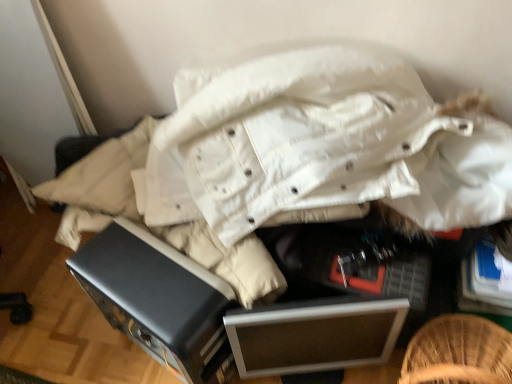
What is the approximate width of silver metallic file cabinet at center?

The width of silver metallic file cabinet at center is 14.58 centimeters.

This screenshot has width=512, height=384. In order to click on silver metallic file cabinet at center in this screenshot , I will do `click(314, 332)`.

What do you see at coordinates (314, 332) in the screenshot?
I see `silver metallic file cabinet at center` at bounding box center [314, 332].

In order to face silver metallic file cabinet at center, should I rotate leftwards or rightwards?

Turn right approximately 7.683 degrees to face it.

Image resolution: width=512 pixels, height=384 pixels. What are the coordinates of `black plastic drawer at center` in the screenshot? It's located at (224, 315).

Image resolution: width=512 pixels, height=384 pixels. What do you see at coordinates (224, 315) in the screenshot?
I see `black plastic drawer at center` at bounding box center [224, 315].

Measure the distance between black plastic drawer at center and camera.

The depth of black plastic drawer at center is 86.04 centimeters.

At what (x,y) coordinates should I click in order to perform the action: click on silver metallic file cabinet at center. Please return your answer as a coordinate pair (x, y). This screenshot has height=384, width=512. Looking at the image, I should click on (314, 332).

Consider the image. Considering the relative positions of silver metallic file cabinet at center and black plastic drawer at center in the image provided, is silver metallic file cabinet at center to the left or to the right of black plastic drawer at center?

Clearly, silver metallic file cabinet at center is on the right of black plastic drawer at center in the image.

Is silver metallic file cabinet at center closer to camera compared to black plastic drawer at center?

No, it is not.

Which is in front, point (239, 335) or point (182, 331)?

Point (182, 331)

From the image's perspective, is silver metallic file cabinet at center under black plastic drawer at center?

Indeed, from the image's perspective, silver metallic file cabinet at center is shown beneath black plastic drawer at center.

From a real-world perspective, which is physically above, silver metallic file cabinet at center or black plastic drawer at center?

black plastic drawer at center is physically above.

In the scene shown: Considering the sizes of objects silver metallic file cabinet at center and black plastic drawer at center in the image provided, who is thinner, silver metallic file cabinet at center or black plastic drawer at center?

silver metallic file cabinet at center is thinner.

Does silver metallic file cabinet at center have a lesser height compared to black plastic drawer at center?

Correct, silver metallic file cabinet at center is not as tall as black plastic drawer at center.

Which of these two, silver metallic file cabinet at center or black plastic drawer at center, is smaller?

Smaller between the two is silver metallic file cabinet at center.

Is silver metallic file cabinet at center completely or partially outside of black plastic drawer at center?

silver metallic file cabinet at center is positioned outside black plastic drawer at center.

Would you consider silver metallic file cabinet at center to be distant from black plastic drawer at center?

silver metallic file cabinet at center is near black plastic drawer at center, not far away.

Does silver metallic file cabinet at center turn towards black plastic drawer at center?

No, silver metallic file cabinet at center does not turn towards black plastic drawer at center.

What's the angular difference between silver metallic file cabinet at center and black plastic drawer at center's facing directions?

They differ by 47.5 degrees in their facing directions.

Find the location of `furniture located on the left of silver metallic file cabinet at center`. furniture located on the left of silver metallic file cabinet at center is located at coordinates (224, 315).

Can you confirm if black plastic drawer at center is positioned to the right of silver metallic file cabinet at center?

No.

Which is in front, black plastic drawer at center or silver metallic file cabinet at center?

black plastic drawer at center.

Considering the positions of points (366, 314) and (372, 348), is point (366, 314) closer to camera compared to point (372, 348)?

Yes, it is.

From the image's perspective, is black plastic drawer at center located above or below silver metallic file cabinet at center?

Clearly, from the image's perspective, black plastic drawer at center is above silver metallic file cabinet at center.

From a real-world perspective, is black plastic drawer at center under silver metallic file cabinet at center?

No, from a real-world perspective, black plastic drawer at center is not beneath silver metallic file cabinet at center.

In terms of width, does black plastic drawer at center look wider or thinner when compared to silver metallic file cabinet at center?

In the image, black plastic drawer at center appears to be wider than silver metallic file cabinet at center.

Who is shorter, black plastic drawer at center or silver metallic file cabinet at center?

With less height is silver metallic file cabinet at center.

Can you confirm if black plastic drawer at center is bigger than silver metallic file cabinet at center?

Yes.

Is black plastic drawer at center positioned beyond the bounds of silver metallic file cabinet at center?

black plastic drawer at center lies outside silver metallic file cabinet at center's area.

Would you say black plastic drawer at center is a long distance from silver metallic file cabinet at center?

Actually, black plastic drawer at center and silver metallic file cabinet at center are a little close together.

Is black plastic drawer at center positioned with its back to silver metallic file cabinet at center?

No, black plastic drawer at center's orientation is not away from silver metallic file cabinet at center.

Can you tell me how much black plastic drawer at center and silver metallic file cabinet at center differ in facing direction?

47.5 degrees.

Measure the distance between black plastic drawer at center and silver metallic file cabinet at center.

2.66 inches.

Where is `file cabinet that is under the black plastic drawer at center (from a real-world perspective)`? Image resolution: width=512 pixels, height=384 pixels. file cabinet that is under the black plastic drawer at center (from a real-world perspective) is located at coordinates (314, 332).

In the image, there is a black plastic drawer at center. At what (x,y) coordinates should I click in order to perform the action: click on file cabinet below it (from a real-world perspective). Please return your answer as a coordinate pair (x, y). Looking at the image, I should click on (314, 332).

Identify the location of file cabinet that is below the black plastic drawer at center (from the image's perspective). (314, 332).